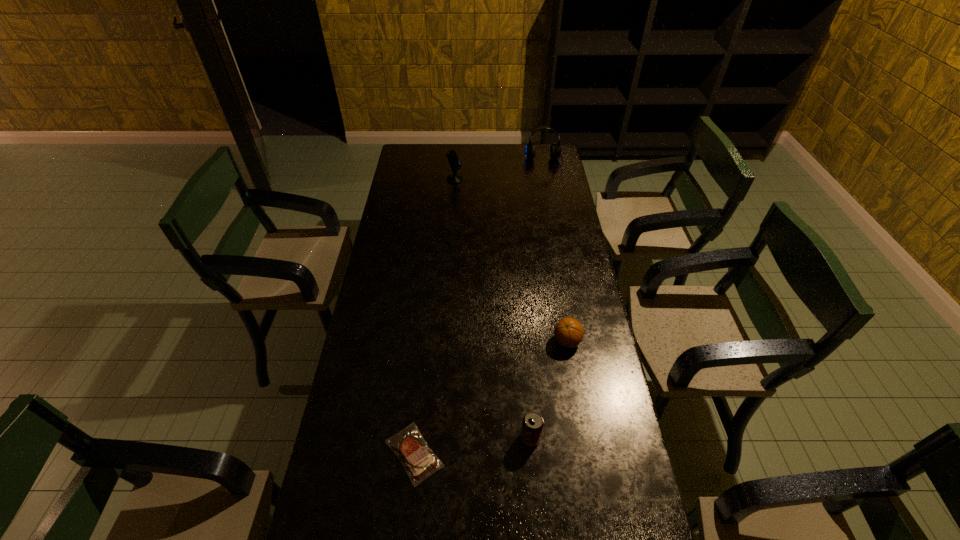
The image size is (960, 540). Identify the location of headset. (555, 150).

Where is `microphone`? microphone is located at coordinates point(454,162).

Where is `soda can`? This screenshot has width=960, height=540. soda can is located at coordinates point(532,425).

This screenshot has width=960, height=540. Find the location of `the third farthest object`. the third farthest object is located at coordinates (568, 332).

I want to click on steak, so click(x=419, y=461).

Where is `blank area located on the ear cushions of the farthest object`? blank area located on the ear cushions of the farthest object is located at coordinates pyautogui.click(x=548, y=187).

Where is `free location located on the stand of the second farthest object`? This screenshot has width=960, height=540. free location located on the stand of the second farthest object is located at coordinates (513, 179).

Where is `vacant space located 0.160m on the right of the soda can`? This screenshot has height=540, width=960. vacant space located 0.160m on the right of the soda can is located at coordinates (596, 437).

Locate an element on the screen. This screenshot has height=540, width=960. vacant area situated 0.210m on the front of the third nearest object is located at coordinates (579, 412).

Locate an element on the screen. The height and width of the screenshot is (540, 960). vacant area situated on the back of the shortest object is located at coordinates (425, 345).